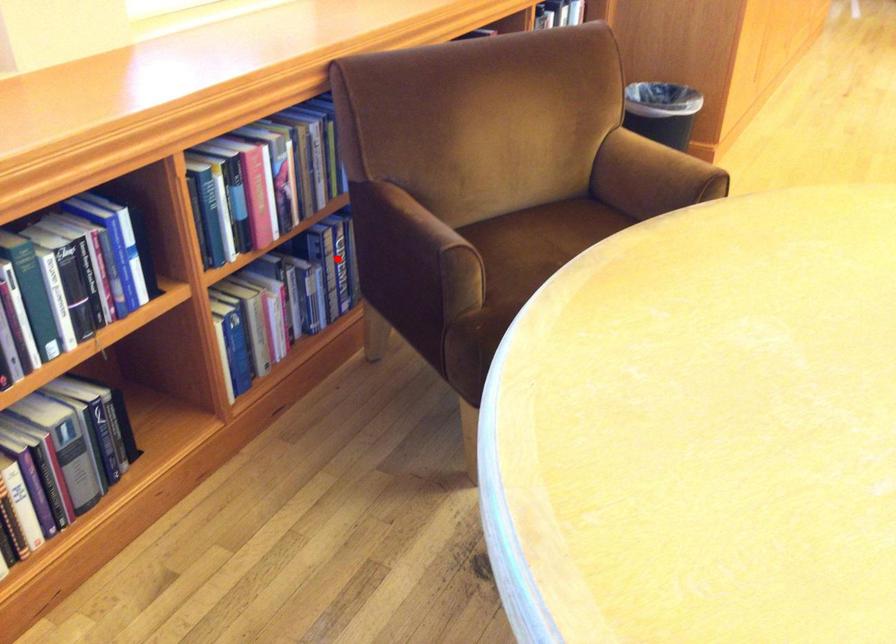
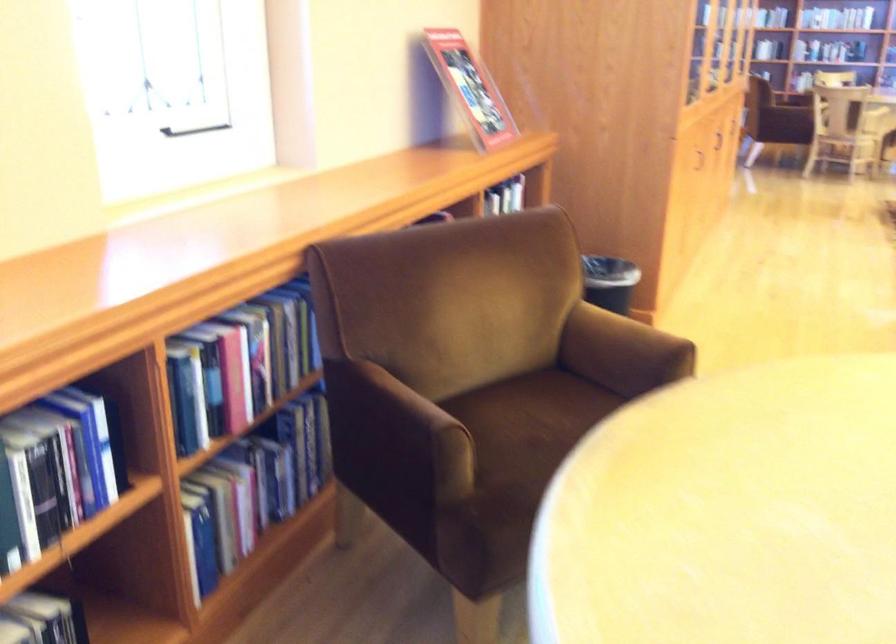
The point at the highlighted location is marked in the first image. Where is the corresponding point in the second image?

(306, 440)